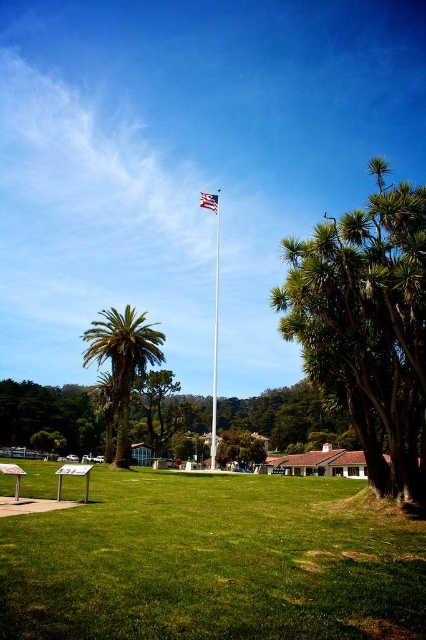
Does polished metal flag pole at center appear on the right side of wooden picnic table at lower left?

Correct, you'll find polished metal flag pole at center to the right of wooden picnic table at lower left.

Can you confirm if polished metal flag pole at center is thinner than wooden picnic table at lower left?

Yes, polished metal flag pole at center is thinner than wooden picnic table at lower left.

Which is behind, point (215, 458) or point (58, 480)?

Positioned behind is point (215, 458).

Where is `polished metal flag pole at center`? Image resolution: width=426 pixels, height=640 pixels. polished metal flag pole at center is located at coordinates (215, 328).

Does point (17, 486) come behind point (216, 208)?

No, (17, 486) is in front of (216, 208).

Which of these two, brown wooden picnic table at center or american flag at center, stands shorter?

brown wooden picnic table at center is shorter.

Does point (19, 490) come closer to viewer compared to point (201, 198)?

Yes, point (19, 490) is in front of point (201, 198).

Locate an element on the screen. The height and width of the screenshot is (640, 426). brown wooden picnic table at center is located at coordinates (13, 476).

Which of these two, green leafy tree at right or american flag at center, stands shorter?

green leafy tree at right is shorter.

Does green leafy tree at right have a larger size compared to american flag at center?

Incorrect, green leafy tree at right is not larger than american flag at center.

Locate an element on the screen. green leafy tree at right is located at coordinates (368, 324).

Identify the location of green leafy tree at right. The height and width of the screenshot is (640, 426). (368, 324).